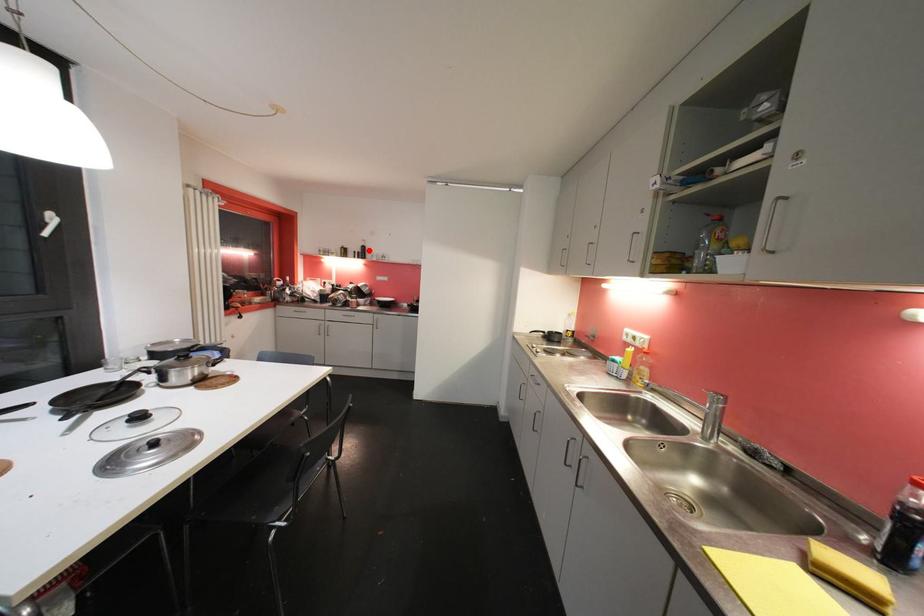
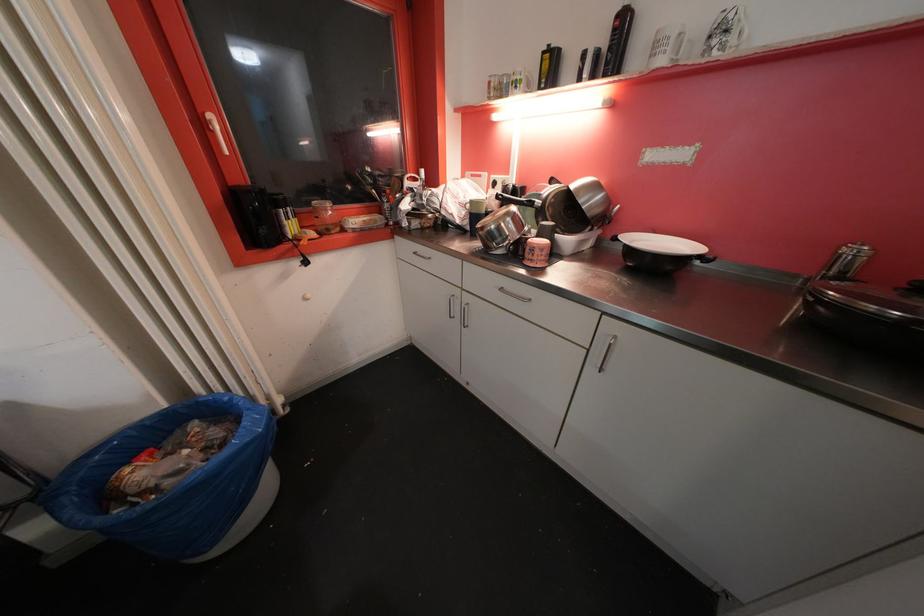
Where in the second image is the point corresponding to the highlighted location from the first image?

(628, 25)